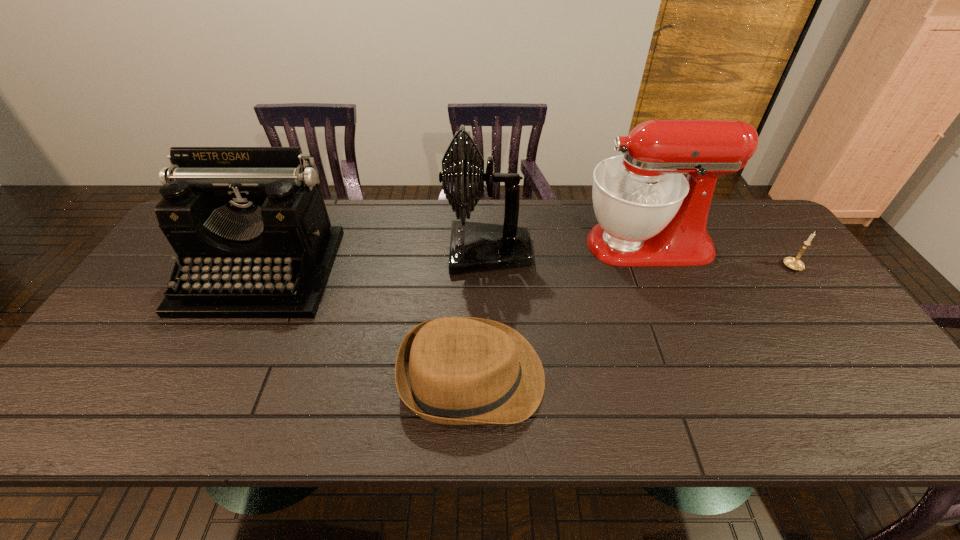
Where is `mixer`? This screenshot has width=960, height=540. mixer is located at coordinates (649, 214).

Identify the location of fan. Image resolution: width=960 pixels, height=540 pixels. (474, 246).

What are the coordinates of `typewriter` in the screenshot? It's located at click(249, 225).

Where is `the leftmost object`? This screenshot has height=540, width=960. the leftmost object is located at coordinates pyautogui.click(x=249, y=225).

Where is `the rightmost object`? This screenshot has height=540, width=960. the rightmost object is located at coordinates (793, 263).

This screenshot has height=540, width=960. Identify the location of fedora. (454, 370).

Find the location of `blank space located 0.170m at the attachment hub of the mixer`. blank space located 0.170m at the attachment hub of the mixer is located at coordinates (525, 245).

Where is `vacant space located at the attachment hub of the mixer`? vacant space located at the attachment hub of the mixer is located at coordinates (467, 245).

Image resolution: width=960 pixels, height=540 pixels. I want to click on vacant space positioned 0.370m at the attachment hub of the mixer, so click(460, 245).

Identify the location of vacant region located in front of the fan to blow air. The height and width of the screenshot is (540, 960). (401, 251).